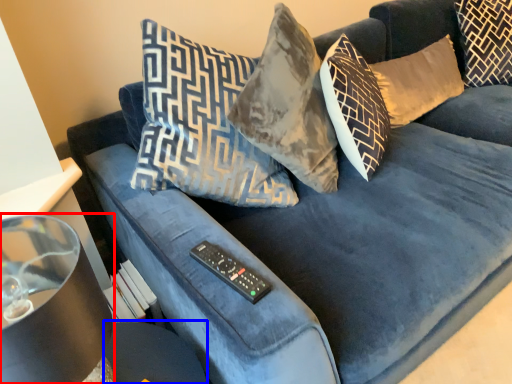
Question: Which object is closer to the camera taking this photo, lamp (highlighted by a red box) or glass table (highlighted by a blue box)?

Choices:
 (A) lamp
 (B) glass table

Answer: (A)